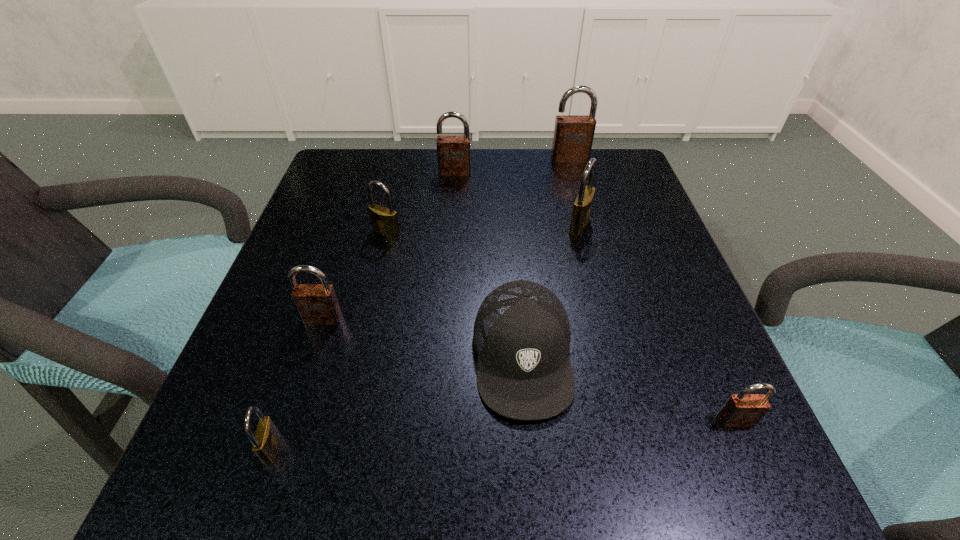
Image resolution: width=960 pixels, height=540 pixels. I want to click on free spot between the fourth padlock from left to right and the farthest object, so click(513, 166).

Find the location of a particular element. object that is the third closest to the smallest brass padlock is located at coordinates (384, 221).

Point out which object is positioned as the seventh nearest to the second brown padlock from right to left. Please provide its 2D coordinates. Your answer should be formatted as a tuple, i.e. [(x, y)], where the tuple contains the x and y coordinates of a point satisfying the conditions above.

[(266, 440)]

Point out which padlock is positioned as the fourth nearest to the fourth object from right to left. Please provide its 2D coordinates. Your answer should be formatted as a tuple, i.e. [(x, y)], where the tuple contains the x and y coordinates of a point satisfying the conditions above.

[(384, 221)]

You are a GUI agent. You are given a task and a screenshot of the screen. Output one action in this format:
    pyautogui.click(x=<x>, y=<y>)
    Task: Click on the fifth closest padlock relative to the nearest padlock
    
    Given the screenshot: What is the action you would take?
    pyautogui.click(x=453, y=152)

You are a GUI agent. You are given a task and a screenshot of the screen. Output one action in this format:
    pyautogui.click(x=<x>, y=<y>)
    Task: Click on the brown padlock that is the third closest one to the second nearest brown padlock
    This screenshot has height=540, width=960.
    Given the screenshot: What is the action you would take?
    573,136

Identify which brown padlock is the nearest to the third brown padlock from right to left. Please provide its 2D coordinates. Your answer should be formatted as a tuple, i.e. [(x, y)], where the tuple contains the x and y coordinates of a point satisfying the conditions above.

[(573, 136)]

Find the location of `brass padlock that stands as the closest to the tallest padlock`. brass padlock that stands as the closest to the tallest padlock is located at coordinates (582, 206).

Find the location of `brass padlock that stands as the second closest to the nearest brass padlock`. brass padlock that stands as the second closest to the nearest brass padlock is located at coordinates (x=582, y=206).

You are a GUI agent. You are given a task and a screenshot of the screen. Output one action in this format:
    pyautogui.click(x=<x>, y=<y>)
    Task: Click on the vacant region that satisfies the following two spatial constraints: 1. on the back side of the nearest object; 2. on the left side of the third object from left to right
    Image resolution: width=960 pixels, height=540 pixels.
    Given the screenshot: What is the action you would take?
    pos(346,233)